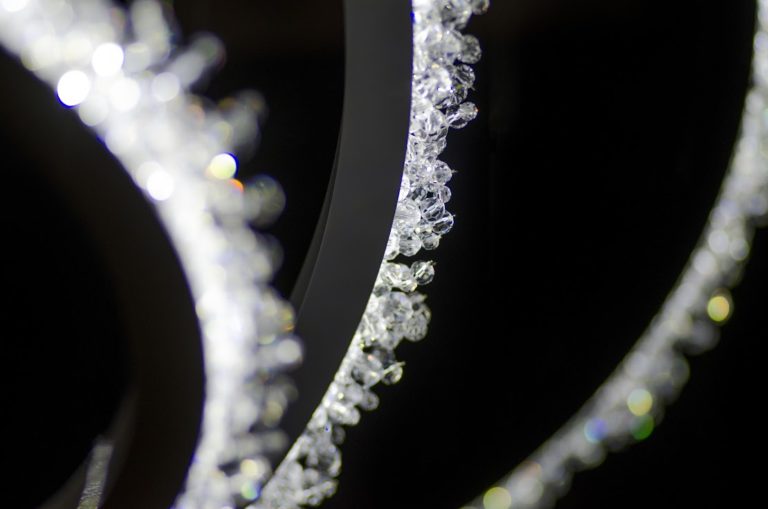
Identify the location of bright white light. Image resolution: width=768 pixels, height=509 pixels. (111, 62), (64, 90), (120, 96), (229, 160), (151, 187).